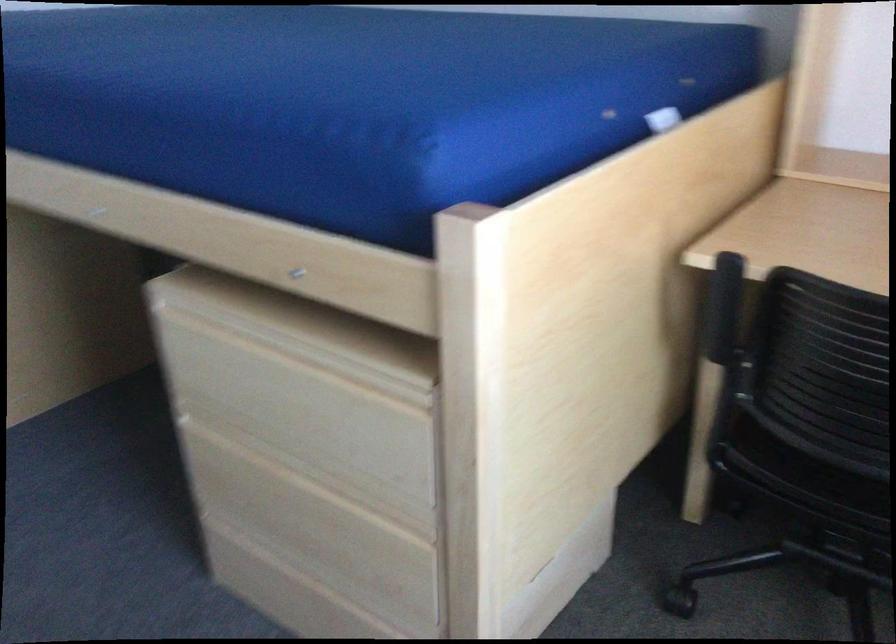
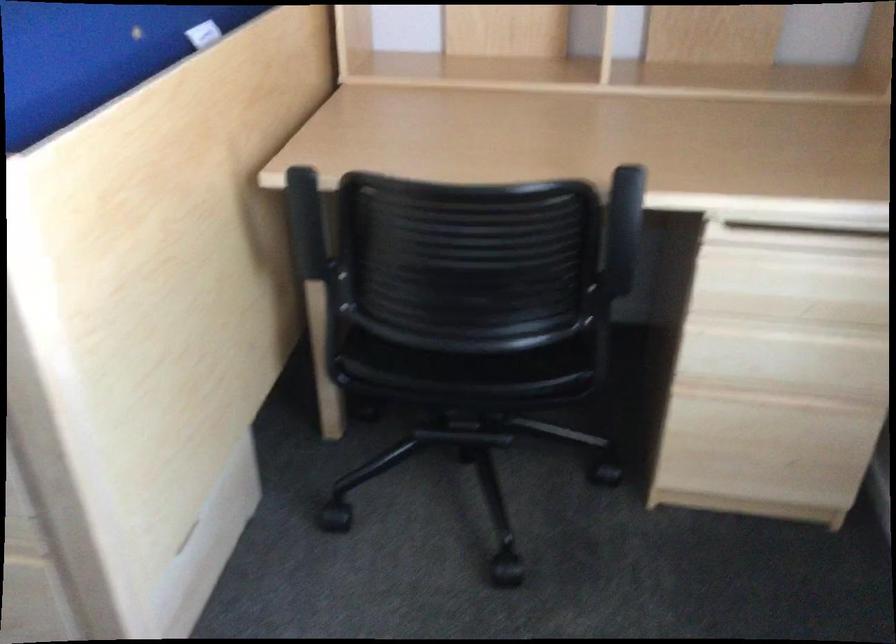
In the second image, find the point that corresponds to point (814, 475) in the first image.

(433, 361)